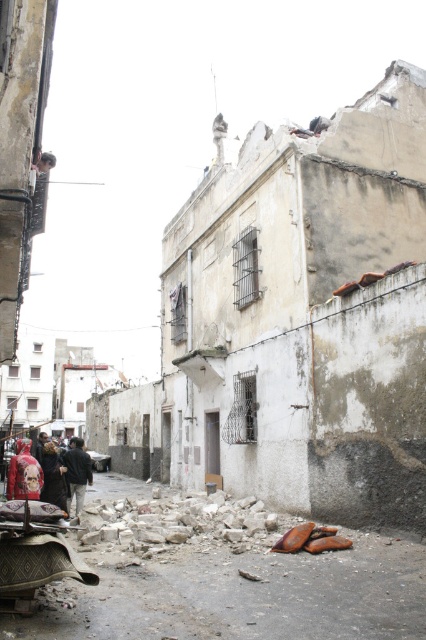
Question: Which point is farther to the camera?

Choices:
 (A) rusty metal shoes at lower center
 (B) dark gray jacket at lower left
 (C) rustic wood cart at lower left

Answer: (B)

Question: Which point appears farthest from the camera in this image?

Choices:
 (A) (8, 589)
 (B) (206, 545)
 (C) (74, 460)

Answer: (C)

Question: Can you confirm if rustic wood cart at lower left is wider than dark gray jacket at lower left?

Choices:
 (A) no
 (B) yes

Answer: (A)

Question: Does rustic wood cart at lower left appear on the left side of dark gray jacket at lower left?

Choices:
 (A) no
 (B) yes

Answer: (A)

Question: Is rustic wood cart at lower left wider than dark gray jacket at lower left?

Choices:
 (A) yes
 (B) no

Answer: (B)

Question: Which object is the farthest from the dark gray jacket at lower left?

Choices:
 (A) rustic wood cart at lower left
 (B) rusty metal shoes at lower center

Answer: (A)